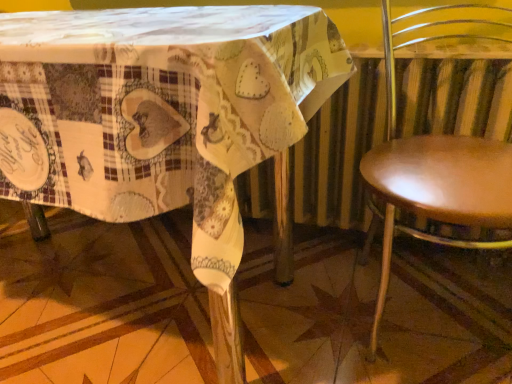
Question: Does printed fabric table at center turn towards shiny brown seat at right?

Choices:
 (A) no
 (B) yes

Answer: (A)

Question: Is shiny brown seat at right located within printed fabric table at center?

Choices:
 (A) yes
 (B) no

Answer: (B)

Question: From a real-world perspective, is printed fabric table at center over shiny brown seat at right?

Choices:
 (A) no
 (B) yes

Answer: (B)

Question: Is printed fabric table at center shorter than shiny brown seat at right?

Choices:
 (A) no
 (B) yes

Answer: (B)

Question: Is printed fabric table at center smaller than shiny brown seat at right?

Choices:
 (A) yes
 (B) no

Answer: (B)

Question: Is printed fabric table at center taller than shiny brown seat at right?

Choices:
 (A) no
 (B) yes

Answer: (A)

Question: Considering the relative sizes of shiny brown seat at right and printed fabric table at center in the image provided, is shiny brown seat at right smaller than printed fabric table at center?

Choices:
 (A) no
 (B) yes

Answer: (B)

Question: From a real-world perspective, is shiny brown seat at right positioned over printed fabric table at center based on gravity?

Choices:
 (A) yes
 (B) no

Answer: (B)

Question: Is shiny brown seat at right aimed at printed fabric table at center?

Choices:
 (A) no
 (B) yes

Answer: (A)

Question: Can you confirm if shiny brown seat at right is bigger than printed fabric table at center?

Choices:
 (A) no
 (B) yes

Answer: (A)

Question: Is printed fabric table at center completely or partially inside shiny brown seat at right?

Choices:
 (A) no
 (B) yes

Answer: (A)

Question: Is shiny brown seat at right positioned beyond the bounds of printed fabric table at center?

Choices:
 (A) yes
 (B) no

Answer: (A)

Question: Considering the positions of shiny brown seat at right and printed fabric table at center in the image, is shiny brown seat at right taller or shorter than printed fabric table at center?

Choices:
 (A) tall
 (B) short

Answer: (A)